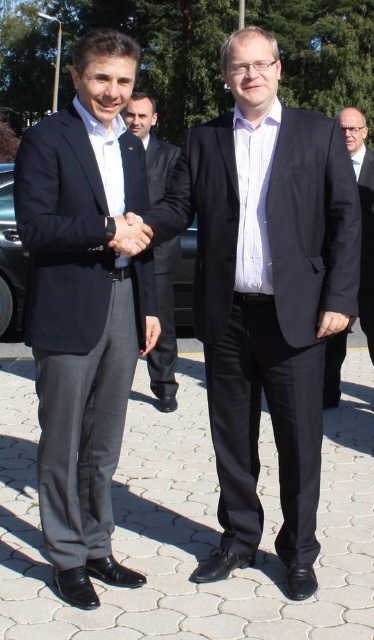
You are a photographer at a formal event. You need to position a camera stand between the matte black suit at left and the dark gray suit at right so that both subjects are in frame. Given that the camera stand requires 1 meter of space to the left and right, will there be enough space between them?

The matte black suit at left has a lesser height compared to dark gray suit at right, but the question is about space between them, not their heights. The provided information does not specify the distance between the two suits, so it cannot be determined if the camera stand will fit.

You are a photographer at the event and need to position yourself to capture a photo of the matte black suit at center without including the car parked behind them. Based on the coordinates provided, can you determine if the car is within the frame of the current camera position?

The matte black suit at center is located at point (265,292). Since the car is parked behind them, it is likely outside the frame if the camera is positioned to focus on the suit at those coordinates.